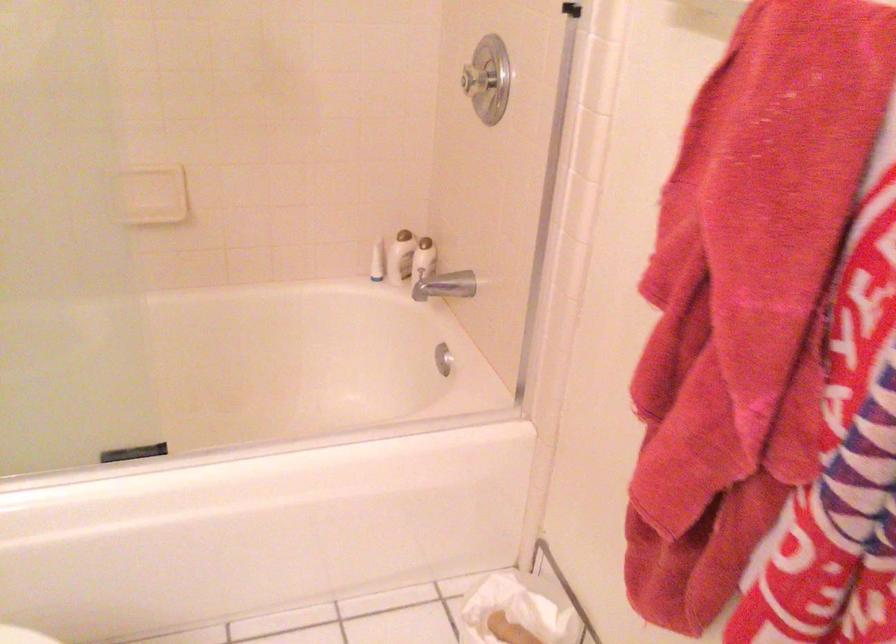
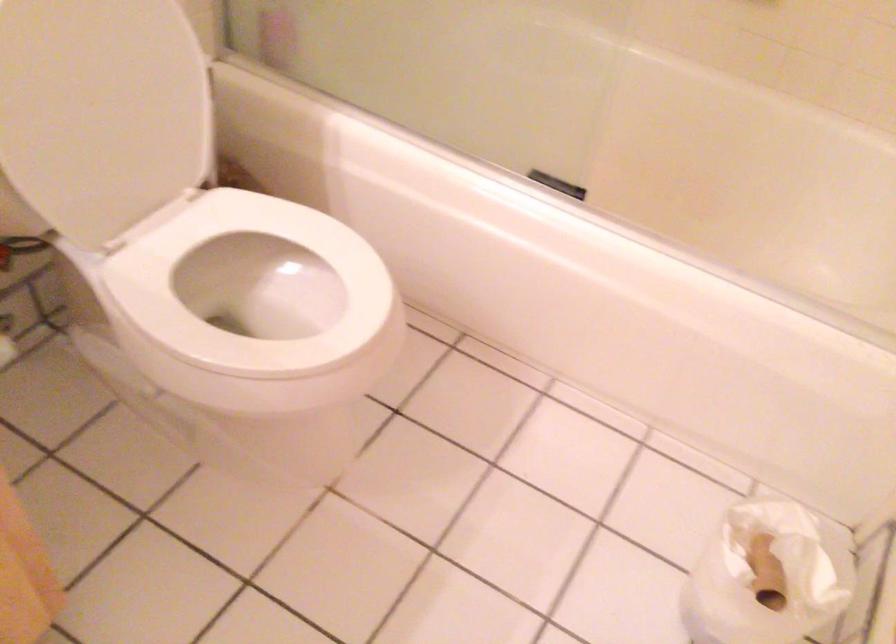
The images are taken continuously from a first-person perspective. In which direction is your viewpoint rotating?

The camera rotated toward left-down.